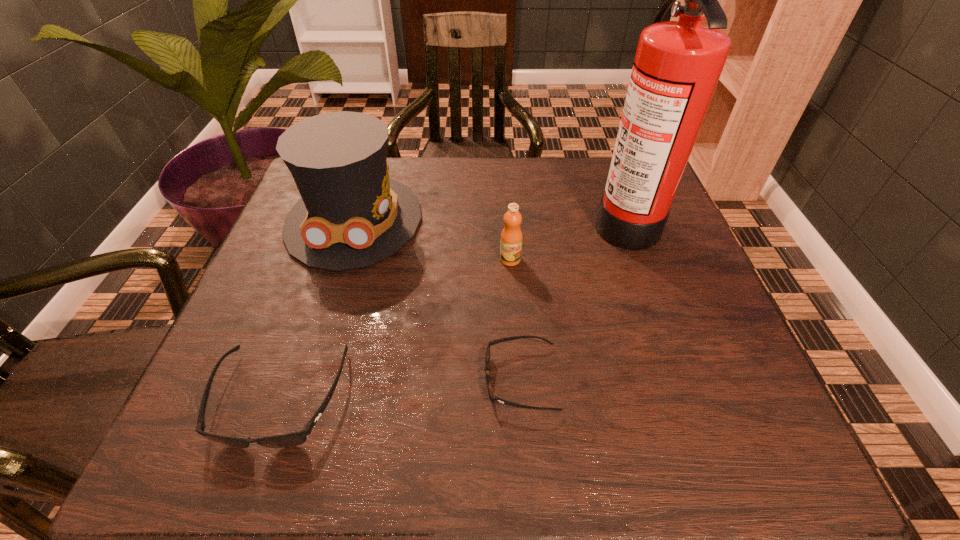
Locate an element on the screen. This screenshot has width=960, height=540. vacant space that is in between the right sunglasses and the taller sunglasses is located at coordinates (400, 389).

This screenshot has height=540, width=960. What are the coordinates of `vacant area that lies between the left sunglasses and the dress hat` in the screenshot? It's located at (317, 309).

Where is `free space between the third shortest object and the rightmost object`? The height and width of the screenshot is (540, 960). free space between the third shortest object and the rightmost object is located at coordinates (567, 240).

At what (x,y) coordinates should I click in order to perform the action: click on free space between the orange juice and the second tallest object. Please return your answer as a coordinate pair (x, y). The height and width of the screenshot is (540, 960). Looking at the image, I should click on (432, 240).

At what (x,y) coordinates should I click in order to perform the action: click on vacant area that lies between the fourth shortest object and the rightmost object. Please return your answer as a coordinate pair (x, y). This screenshot has width=960, height=540. Looking at the image, I should click on pyautogui.click(x=490, y=220).

Find the location of a particular element. This screenshot has height=540, width=960. free space between the second tallest object and the orange juice is located at coordinates (432, 240).

Locate an element on the screen. Image resolution: width=960 pixels, height=540 pixels. vacant area that lies between the shortest object and the third tallest object is located at coordinates (516, 319).

This screenshot has height=540, width=960. Identify the location of vacant space that's between the third tallest object and the second tallest object. (432, 240).

At what (x,y) coordinates should I click in order to perform the action: click on empty space that is in between the dress hat and the fourth tallest object. Please return your answer as a coordinate pair (x, y). The height and width of the screenshot is (540, 960). Looking at the image, I should click on (317, 309).

The height and width of the screenshot is (540, 960). What are the coordinates of `object that is the fourth closest to the left sunglasses` in the screenshot? It's located at (677, 66).